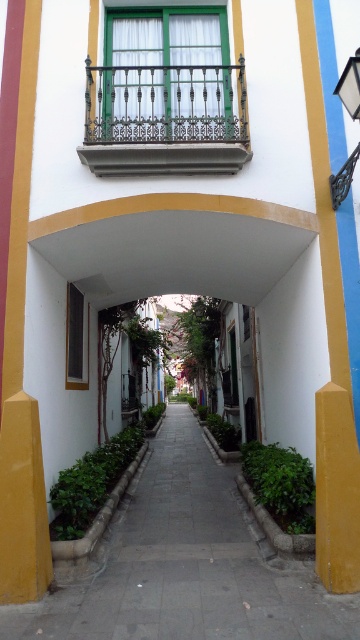
Who is more distant from viewer, (146,577) or (132,113)?

The point (132,113) is behind.

Based on the photo, can you confirm if paved stone walkway at center is thinner than wrought iron balcony at upper center?

No.

Is point (69, 593) positioned behind point (212, 84)?

That is False.

You are a GUI agent. You are given a task and a screenshot of the screen. Output one action in this format:
    pyautogui.click(x=<x>, y=<y>)
    Task: Click on the paved stone walkway at center
    
    Given the screenshot: What is the action you would take?
    pyautogui.click(x=185, y=564)